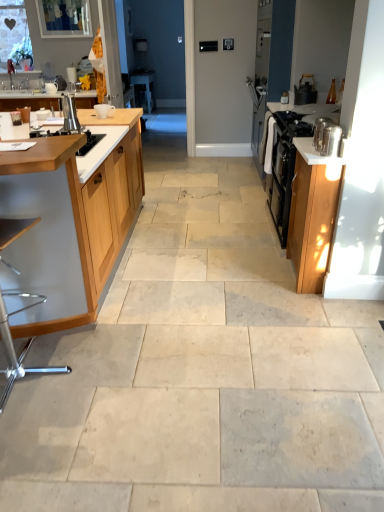
Question: Is transparent glass screen door at center surrounded by satin silver kettle at left, placed as the 1th appliance when sorted from back to front?

Choices:
 (A) no
 (B) yes

Answer: (A)

Question: Is satin silver kettle at left, which appears as the second appliance when viewed from the front, behind transparent glass screen door at center?

Choices:
 (A) no
 (B) yes

Answer: (A)

Question: Does satin silver kettle at left, which appears as the second appliance when viewed from the right, have a larger size compared to transparent glass screen door at center?

Choices:
 (A) yes
 (B) no

Answer: (B)

Question: Considering the relative sizes of satin silver kettle at left, placed as the 1th appliance when sorted from back to front, and transparent glass screen door at center in the image provided, is satin silver kettle at left, placed as the 1th appliance when sorted from back to front, wider than transparent glass screen door at center?

Choices:
 (A) yes
 (B) no

Answer: (B)

Question: Is satin silver kettle at left, which appears as the second appliance when viewed from the front, oriented towards transparent glass screen door at center?

Choices:
 (A) yes
 (B) no

Answer: (B)

Question: From the image's perspective, is satin silver kettle at left, the first appliance from the left, under transparent glass screen door at center?

Choices:
 (A) no
 (B) yes

Answer: (B)

Question: Is clear glass window at upper left shorter than glossy wood cabinet at right, acting as the second cabinetry starting from the left?

Choices:
 (A) no
 (B) yes

Answer: (B)

Question: Is glossy wood cabinet at right, which appears as the 1th cabinetry when viewed from the right, located within clear glass window at upper left?

Choices:
 (A) yes
 (B) no

Answer: (B)

Question: Is clear glass window at upper left to the left of glossy wood cabinet at right, acting as the second cabinetry starting from the left, from the viewer's perspective?

Choices:
 (A) yes
 (B) no

Answer: (A)

Question: Does clear glass window at upper left have a greater height compared to glossy wood cabinet at right, which appears as the 1th cabinetry when viewed from the right?

Choices:
 (A) yes
 (B) no

Answer: (B)

Question: From the image's perspective, is clear glass window at upper left under glossy wood cabinet at right, acting as the second cabinetry starting from the left?

Choices:
 (A) no
 (B) yes

Answer: (A)

Question: Is clear glass window at upper left wider than glossy wood cabinet at right, acting as the second cabinetry starting from the left?

Choices:
 (A) no
 (B) yes

Answer: (A)

Question: From the image's perspective, is white glossy table at center over metallic silver containers at right?

Choices:
 (A) no
 (B) yes

Answer: (B)